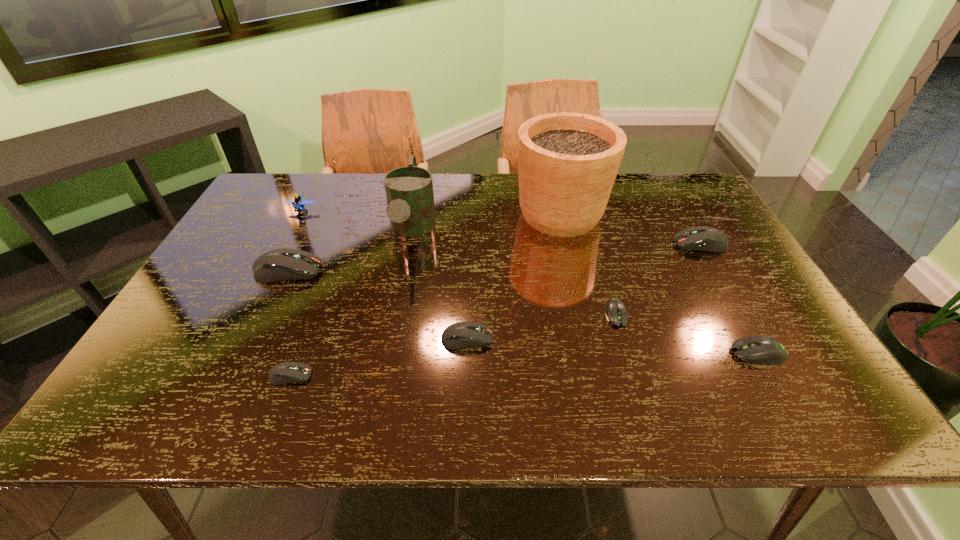
In the image, there is a desktop. At what (x,y) coordinates should I click in order to perform the action: click on blank space at the near left corner. Please return your answer as a coordinate pair (x, y). Looking at the image, I should click on (167, 400).

Where is `free space at the near right corner of the desktop`? The image size is (960, 540). free space at the near right corner of the desktop is located at coordinates 807,401.

At what (x,y) coordinates should I click in order to perform the action: click on free spot between the third farthest dark computer equipment and the fourth object from left to right. Please return your answer as a coordinate pair (x, y). Image resolution: width=960 pixels, height=540 pixels. Looking at the image, I should click on click(440, 285).

At what (x,y) coordinates should I click in order to perform the action: click on free space between the third nearest dark computer equipment and the Lego. Please return your answer as a coordinate pair (x, y). This screenshot has height=540, width=960. Looking at the image, I should click on (295, 240).

This screenshot has height=540, width=960. Find the location of `vacant area that lies between the fifth nearest computer mouse and the farther gray computer mouse`. vacant area that lies between the fifth nearest computer mouse and the farther gray computer mouse is located at coordinates (452, 292).

This screenshot has width=960, height=540. I want to click on free spot between the green watering can and the farther gray computer mouse, so (x=514, y=272).

The height and width of the screenshot is (540, 960). Find the location of `empty space that is in between the blue Lego and the rightmost dark computer equipment`. empty space that is in between the blue Lego and the rightmost dark computer equipment is located at coordinates (501, 227).

Locate an element on the screen. vacant space that's between the tallest object and the fifth shortest computer mouse is located at coordinates (631, 229).

You are a GUI agent. You are given a task and a screenshot of the screen. Output one action in this format:
    pyautogui.click(x=<x>, y=<y>)
    Task: Click on the unoccupied area between the third dark computer equipment from left to right and the bigger gray computer mouse
    
    Given the screenshot: What is the action you would take?
    pyautogui.click(x=612, y=346)

Identify the location of vacant space that is in between the third computer mouse from right to left and the Lego. The height and width of the screenshot is (540, 960). (459, 262).